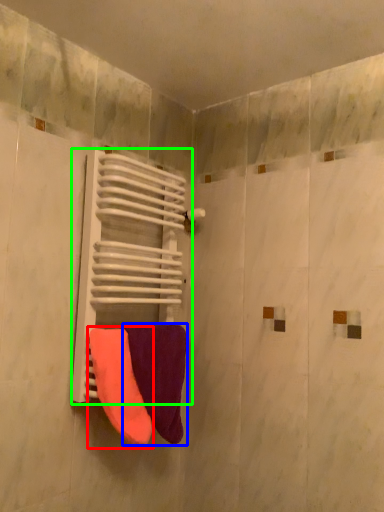
Question: Estimate the real-world distances between objects in this image. Which object is farther from towel (highlighted by a red box), towel (highlighted by a blue box) or radiator (highlighted by a green box)?

Choices:
 (A) towel
 (B) radiator

Answer: (B)